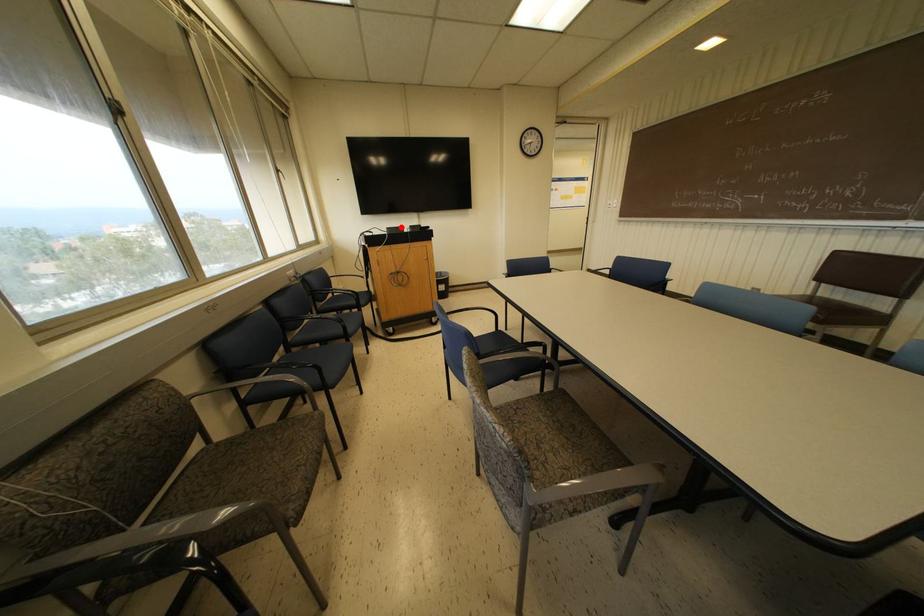
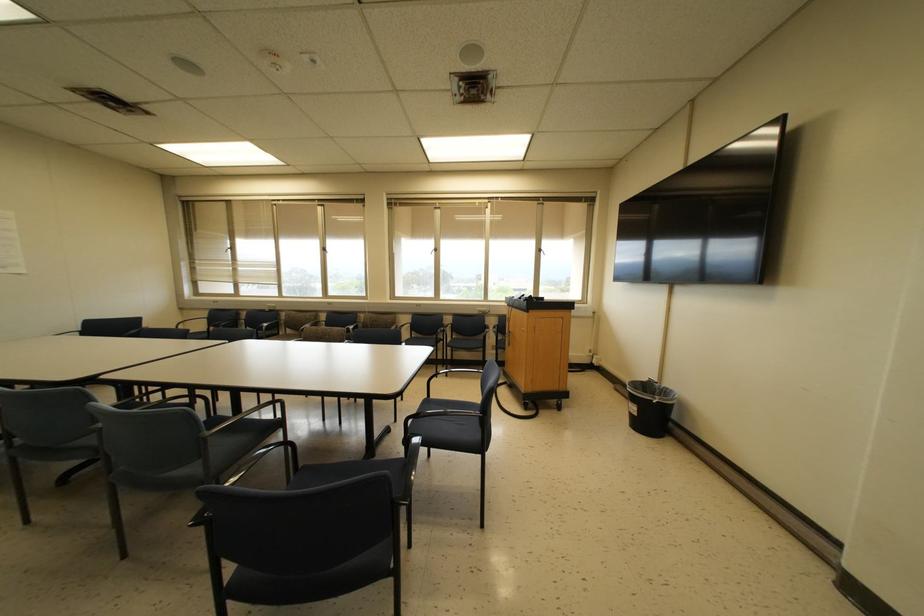
Question: I am providing you with two images of the same scene from different viewpoints. A red point is marked on the first image. Is the red point's position out of view in image 2?

Choices:
 (A) Yes
 (B) No

Answer: (A)